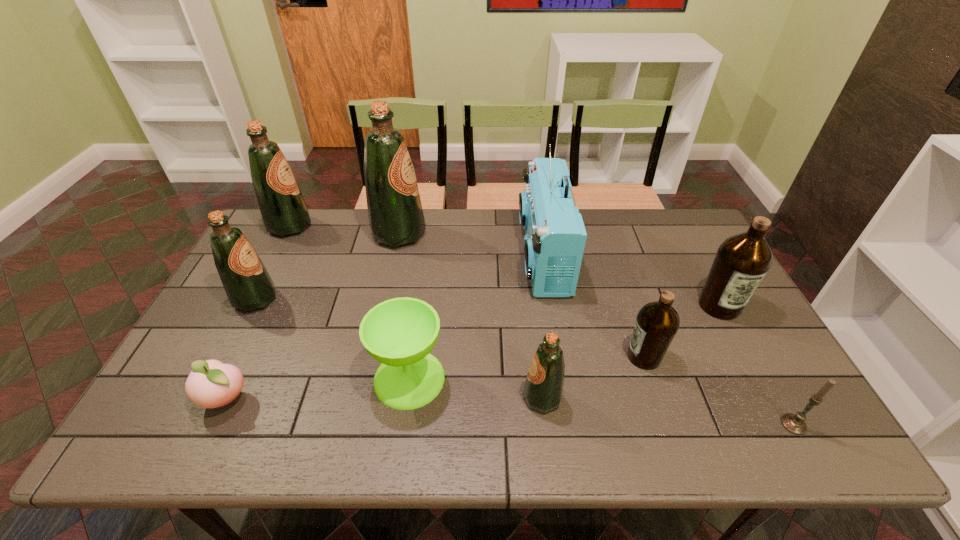
Where is `vacant region between the radio receiver and the second smallest green olive oil`? Image resolution: width=960 pixels, height=540 pixels. vacant region between the radio receiver and the second smallest green olive oil is located at coordinates 399,278.

You are a GUI agent. You are given a task and a screenshot of the screen. Output one action in this format:
    pyautogui.click(x=<x>, y=<y>)
    Task: Click on the vacant area that lies between the third smallest green olive oil and the shortest object
    This screenshot has width=960, height=540.
    Given the screenshot: What is the action you would take?
    pyautogui.click(x=258, y=313)

The image size is (960, 540). I want to click on blank region between the second green olive oil from right to left and the second tallest olive oil, so click(345, 230).

Image resolution: width=960 pixels, height=540 pixels. Find the location of `free space between the second nearest green olive oil and the third smallest green olive oil`. free space between the second nearest green olive oil and the third smallest green olive oil is located at coordinates (273, 262).

You are a GUI agent. You are given a task and a screenshot of the screen. Output one action in this format:
    pyautogui.click(x=<x>, y=<y>)
    Task: Click on the free space between the fifth olive oil from left to right and the wineglass
    This screenshot has width=960, height=540.
    Given the screenshot: What is the action you would take?
    pyautogui.click(x=526, y=368)

Where is `object that stands as the third closest to the blue radio receiver`? object that stands as the third closest to the blue radio receiver is located at coordinates (399, 333).

Identify which object is the fourth nearest to the pink peach. Please provide its 2D coordinates. Your answer should be formatted as a tuple, i.e. [(x, y)], where the tuple contains the x and y coordinates of a point satisfying the conditions above.

[(284, 211)]

This screenshot has height=540, width=960. What are the coordinates of `olive oil that is the closest to the second green olive oil from right to left` in the screenshot? It's located at (284, 211).

Locate which olive oil ranks in proximity to the bigger brown olive oil. Please provide its 2D coordinates. Your answer should be formatted as a tuple, i.e. [(x, y)], where the tuple contains the x and y coordinates of a point satisfying the conditions above.

[(657, 323)]

Where is `the fourth closest green olive oil relative to the radio receiver`? This screenshot has height=540, width=960. the fourth closest green olive oil relative to the radio receiver is located at coordinates (248, 285).